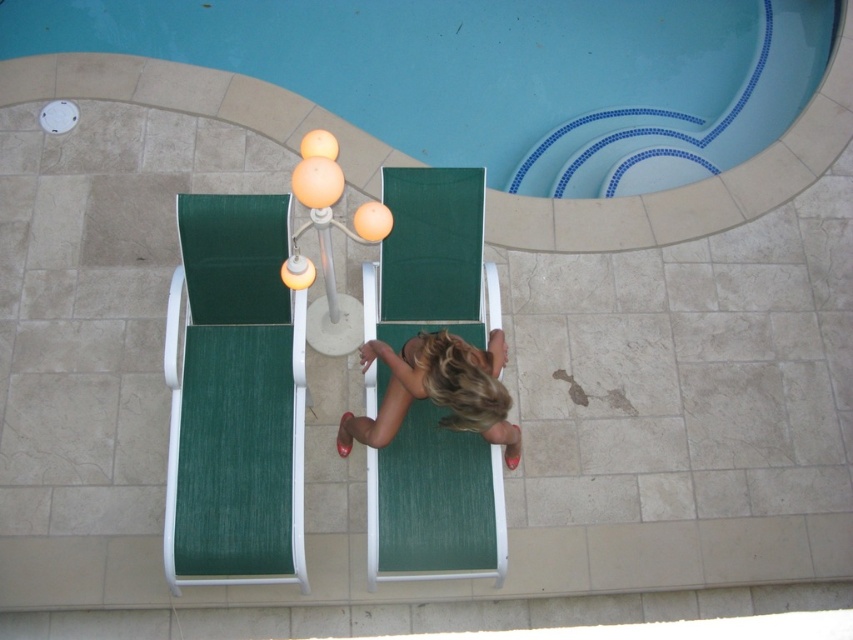
Question: Which point is farther to the camera?

Choices:
 (A) blonde hair at center
 (B) green fabric beach chair at center

Answer: (B)

Question: Is blue tile swimming pool at upper center to the left of blonde hair at center from the viewer's perspective?

Choices:
 (A) yes
 (B) no

Answer: (A)

Question: Which point is closer to the camera?

Choices:
 (A) (450, 380)
 (B) (498, 131)
 (C) (450, 476)

Answer: (A)

Question: Is blue tile swimming pool at upper center thinner than blonde hair at center?

Choices:
 (A) no
 (B) yes

Answer: (A)

Question: Which object appears closest to the camera in this image?

Choices:
 (A) blue tile swimming pool at upper center
 (B) green fabric beach chair at left
 (C) green fabric beach chair at center

Answer: (B)

Question: Is green fabric beach chair at center thinner than blonde hair at center?

Choices:
 (A) no
 (B) yes

Answer: (B)